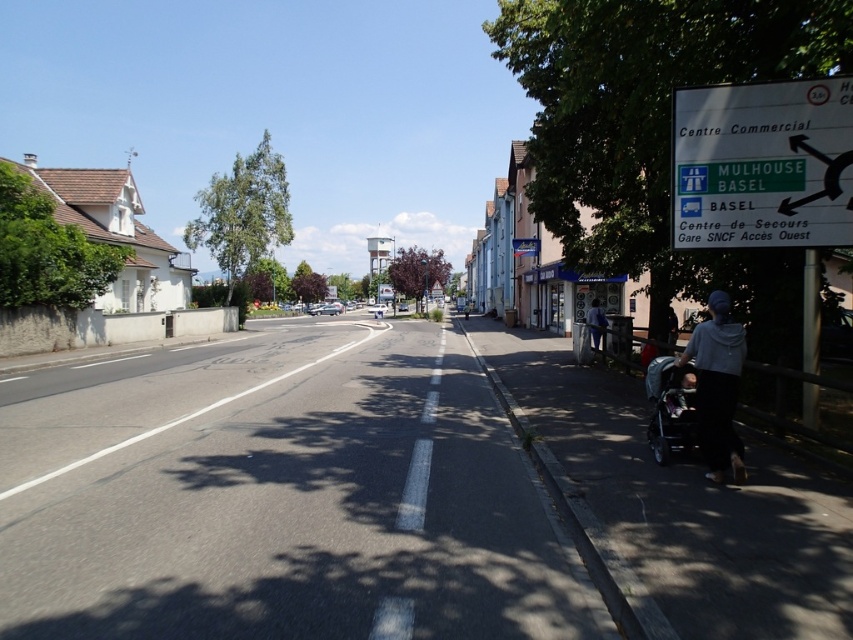
Question: Is white plastic sign at upper right closer to camera compared to light blue denim jacket at right?

Choices:
 (A) yes
 (B) no

Answer: (A)

Question: Is gray fabric at lower right in front of dark gray fabric stroller at lower right?

Choices:
 (A) no
 (B) yes

Answer: (B)

Question: Which is farther from the gray fabric at lower right?

Choices:
 (A) white plastic sign at upper right
 (B) dark gray fabric stroller at lower right
 (C) light blue denim jacket at right

Answer: (C)

Question: Which object is closer to the camera taking this photo?

Choices:
 (A) light blue denim jacket at right
 (B) white plastic sign at upper right
 (C) dark gray fabric stroller at lower right

Answer: (C)

Question: Estimate the real-world distances between objects in this image. Which object is farther from the light blue denim jacket at right?

Choices:
 (A) gray fabric at lower right
 (B) white plastic sign at upper right
 (C) dark gray fabric stroller at lower right

Answer: (A)

Question: Where is gray fabric at lower right located in relation to light blue denim jacket at right in the image?

Choices:
 (A) above
 (B) below

Answer: (B)